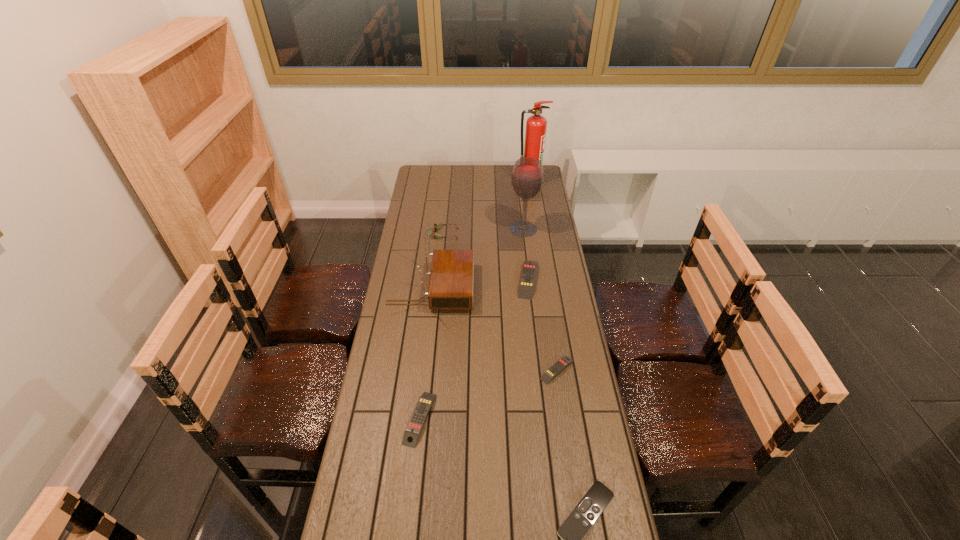
Where is `the second shortest remote control`? Image resolution: width=960 pixels, height=540 pixels. the second shortest remote control is located at coordinates (561, 364).

This screenshot has width=960, height=540. Identify the location of the third nearest remote control. (561, 364).

Image resolution: width=960 pixels, height=540 pixels. I want to click on free space located with the nozzle pointing from the back of the fire extinguisher, so click(x=533, y=198).

Identify the location of vacant space located 0.400m on the front of the alcohol. (532, 299).

This screenshot has height=540, width=960. I want to click on free space located 0.230m on the front panel of the radio_receiver, so click(529, 289).

In order to click on vacant space situated 0.070m on the front-facing side of the spectacles in this screenshot , I will do `click(472, 234)`.

The height and width of the screenshot is (540, 960). In order to click on free space located 0.300m on the front of the farthest yellow remote control in this screenshot , I will do `click(538, 361)`.

Locate an element on the screen. vacant area situated 0.400m on the right of the third farthest remote control is located at coordinates click(x=562, y=419).

Find the location of a particular element. vacant space located 0.070m on the left of the sixth farthest object is located at coordinates (518, 370).

Identify the location of object that is positioned at the far edge. click(536, 125).